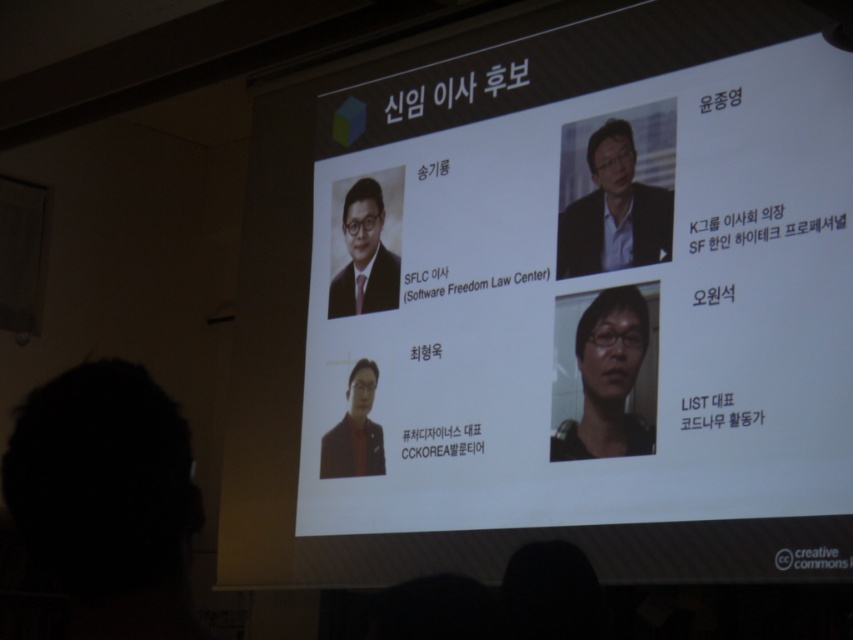
Question: Observing the image, what is the correct spatial positioning of matte black suit at upper right in reference to matte black glasses at center?

Choices:
 (A) above
 (B) below

Answer: (A)

Question: Which object is closer to the camera taking this photo?

Choices:
 (A) matte black laptop at upper center
 (B) matte black suit at center

Answer: (A)

Question: Is matte black glasses at center closer to camera compared to matte black suit at center?

Choices:
 (A) no
 (B) yes

Answer: (B)

Question: Is the position of matte black laptop at upper center less distant than that of matte black suit at center?

Choices:
 (A) no
 (B) yes

Answer: (B)

Question: Which point is farther to the camera?

Choices:
 (A) (364, 234)
 (B) (345, 424)
 (C) (456, 205)

Answer: (A)

Question: Among these objects, which one is nearest to the camera?

Choices:
 (A) matte black glasses at center
 (B) matte black portrait at center
 (C) matte black suit at upper right

Answer: (A)